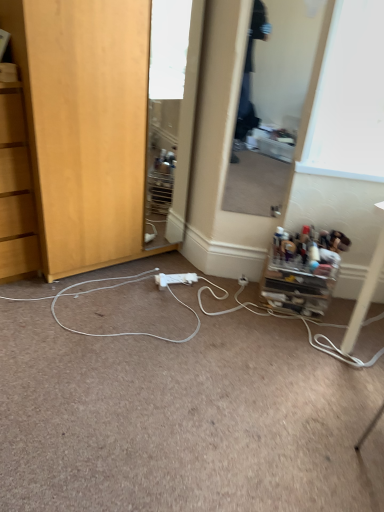
Question: Which direction should I rotate to face clear glass mirror at center, arranged as the 1th mirror when viewed from the right, — up or down?

Choices:
 (A) down
 (B) up

Answer: (B)

Question: From a real-world perspective, is white plastic power outlet at center physically below white plastic power strip at center?

Choices:
 (A) yes
 (B) no

Answer: (B)

Question: Is the surface of white plastic power outlet at center in direct contact with white plastic power strip at center?

Choices:
 (A) no
 (B) yes

Answer: (A)

Question: From the image's perspective, is white plastic power outlet at center under white plastic power strip at center?

Choices:
 (A) yes
 (B) no

Answer: (B)

Question: Could you tell me if white plastic power outlet at center is facing white plastic power strip at center?

Choices:
 (A) no
 (B) yes

Answer: (B)

Question: Can you confirm if white plastic power outlet at center is thinner than white plastic power strip at center?

Choices:
 (A) no
 (B) yes

Answer: (B)

Question: Is white plastic power strip at center a part of white plastic power outlet at center?

Choices:
 (A) no
 (B) yes

Answer: (A)

Question: Considering the relative positions of white plastic power strip at center and clear glass mirror at center, arranged as the 1th mirror when viewed from the right, in the image provided, is white plastic power strip at center to the right of clear glass mirror at center, arranged as the 1th mirror when viewed from the right, from the viewer's perspective?

Choices:
 (A) yes
 (B) no

Answer: (B)

Question: Is white plastic power strip at center directly adjacent to clear glass mirror at center, which is the 2th mirror from left to right?

Choices:
 (A) no
 (B) yes

Answer: (A)

Question: Is white plastic power strip at center shorter than clear glass mirror at center, arranged as the 1th mirror when viewed from the right?

Choices:
 (A) yes
 (B) no

Answer: (A)

Question: Can you confirm if white plastic power strip at center is taller than clear glass mirror at center, arranged as the 1th mirror when viewed from the right?

Choices:
 (A) no
 (B) yes

Answer: (A)

Question: Is white plastic power strip at center not inside clear glass mirror at center, which is the 2th mirror from left to right?

Choices:
 (A) no
 (B) yes

Answer: (B)

Question: Considering the relative sizes of white plastic power strip at center and clear glass mirror at center, which is the 2th mirror from left to right, in the image provided, is white plastic power strip at center bigger than clear glass mirror at center, which is the 2th mirror from left to right,?

Choices:
 (A) yes
 (B) no

Answer: (A)

Question: Can you confirm if white plastic electric outlet at center is wider than wooden cabinet at lower left, placed as the 2th cabinetry when sorted from right to left?

Choices:
 (A) no
 (B) yes

Answer: (A)